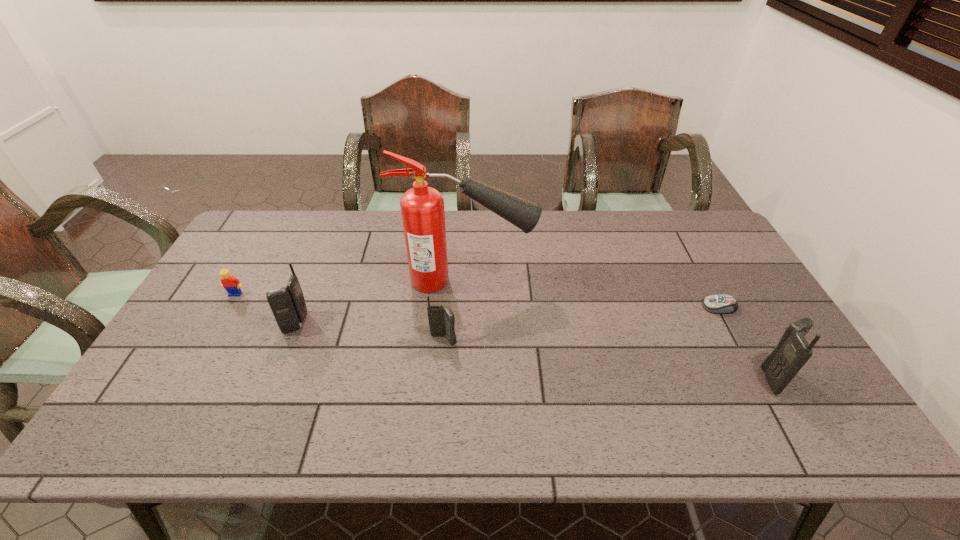
I want to click on vacant position for inserting another cellular_telephone evenly, so [603, 359].